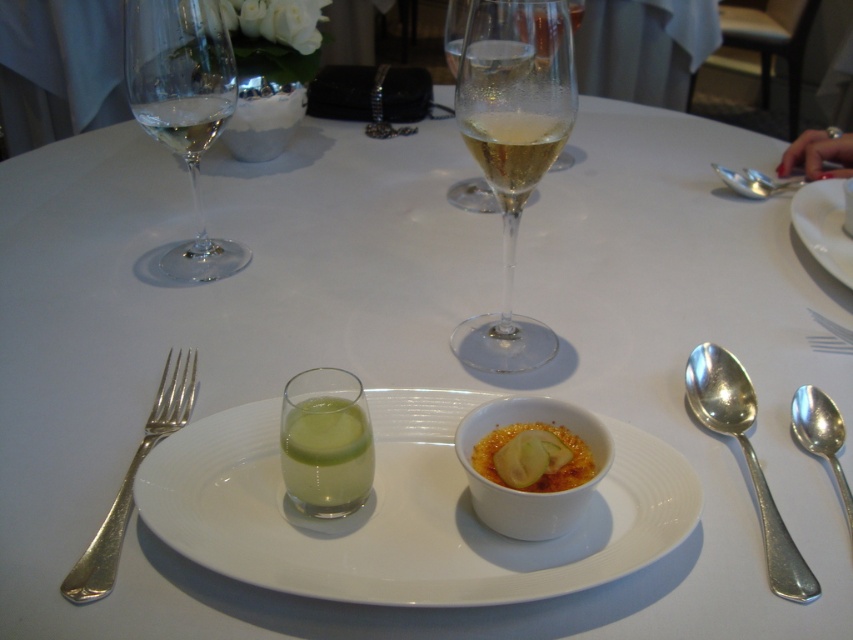
Is silver/glossy spoon at right shorter than silver metallic spoon at right?

No, silver/glossy spoon at right is not shorter than silver metallic spoon at right.

Does silver/glossy spoon at right have a smaller size compared to silver metallic spoon at right?

No, silver/glossy spoon at right is not smaller than silver metallic spoon at right.

Locate an element on the screen. The height and width of the screenshot is (640, 853). silver/glossy spoon at right is located at coordinates (746, 458).

Is point (207, 93) positioned in front of point (839, 464)?

No, it is behind (839, 464).

The height and width of the screenshot is (640, 853). Identify the location of clear glass wine at upper left. point(186,122).

I want to click on clear glass wine at upper left, so click(x=186, y=122).

Is silver/glossy spoon at right shorter than white porcelain plate at upper right?

Yes, silver/glossy spoon at right is shorter than white porcelain plate at upper right.

Consider the image. Between silver/glossy spoon at right and white porcelain plate at upper right, which one is positioned lower?

silver/glossy spoon at right is below.

This screenshot has width=853, height=640. What do you see at coordinates (746, 458) in the screenshot? I see `silver/glossy spoon at right` at bounding box center [746, 458].

At what (x,y) coordinates should I click in order to perform the action: click on silver/glossy spoon at right. Please return your answer as a coordinate pair (x, y). The height and width of the screenshot is (640, 853). Looking at the image, I should click on (746, 458).